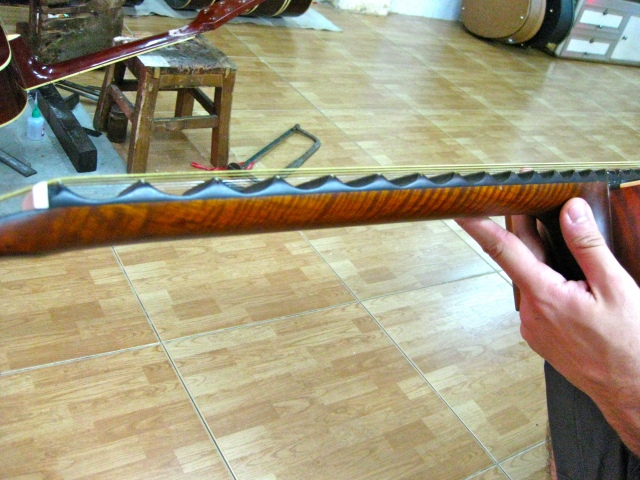
Locate an element on the screen. The image size is (640, 480). bottle is located at coordinates (29, 134).